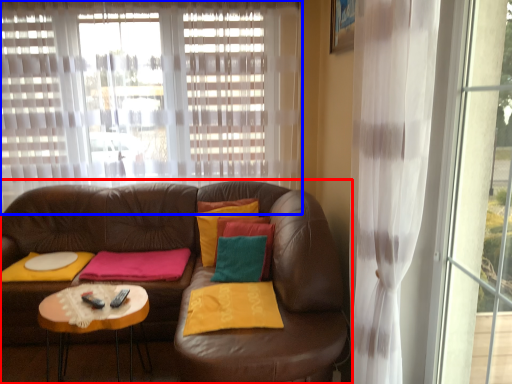
Question: Among these objects, which one is farthest to the camera, studio couch (highlighted by a red box) or curtain (highlighted by a blue box)?

Choices:
 (A) studio couch
 (B) curtain

Answer: (B)